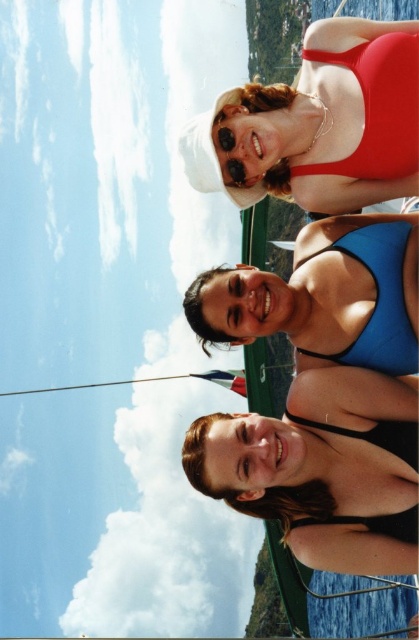
Question: Is black matte swimsuit at lower center smaller than blue matte swimsuit at center?

Choices:
 (A) no
 (B) yes

Answer: (B)

Question: Does matte red swimsuit at upper center appear on the right side of blue matte swimsuit at center?

Choices:
 (A) yes
 (B) no

Answer: (A)

Question: Which point appears farthest from the camera in this image?

Choices:
 (A) (413, 323)
 (B) (264, 92)
 (C) (328, 412)

Answer: (B)

Question: Which of the following is the closest to the observer?

Choices:
 (A) matte red swimsuit at upper center
 (B) blue matte swimsuit at center
 (C) black matte swimsuit at lower center

Answer: (C)

Question: Which point is closer to the camera?

Choices:
 (A) matte red swimsuit at upper center
 (B) blue matte swimsuit at center

Answer: (B)

Question: Can you confirm if black matte swimsuit at lower center is thinner than blue matte swimsuit at center?

Choices:
 (A) no
 (B) yes

Answer: (B)